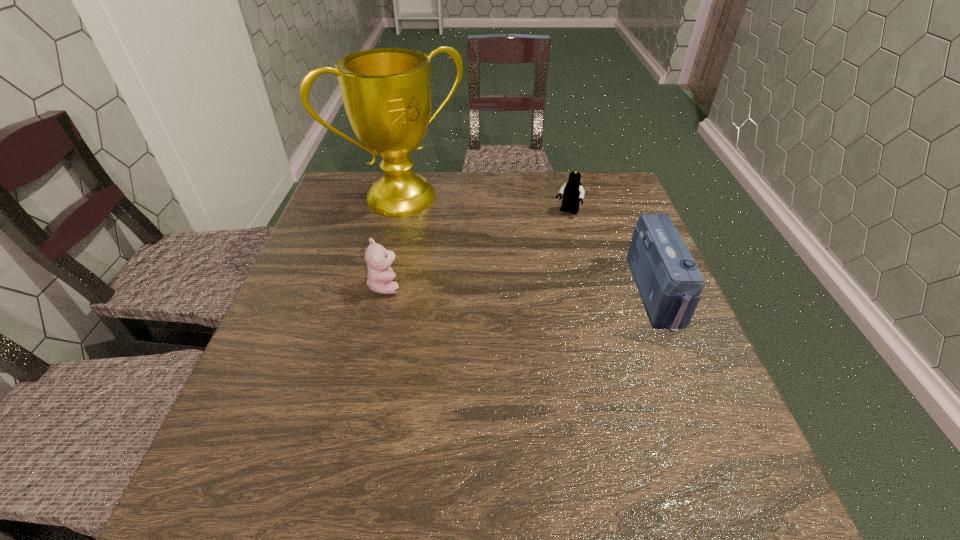
I want to click on vacant spot on the desktop that is between the teddy bear and the camera and is positioned on the shiny surface of the award, so click(489, 288).

At what (x,y) coordinates should I click in order to perform the action: click on free space on the desktop that is between the teddy bear and the camera and is positioned on the front-facing side of the Lego. Please return your answer as a coordinate pair (x, y). The width and height of the screenshot is (960, 540). Looking at the image, I should click on (523, 289).